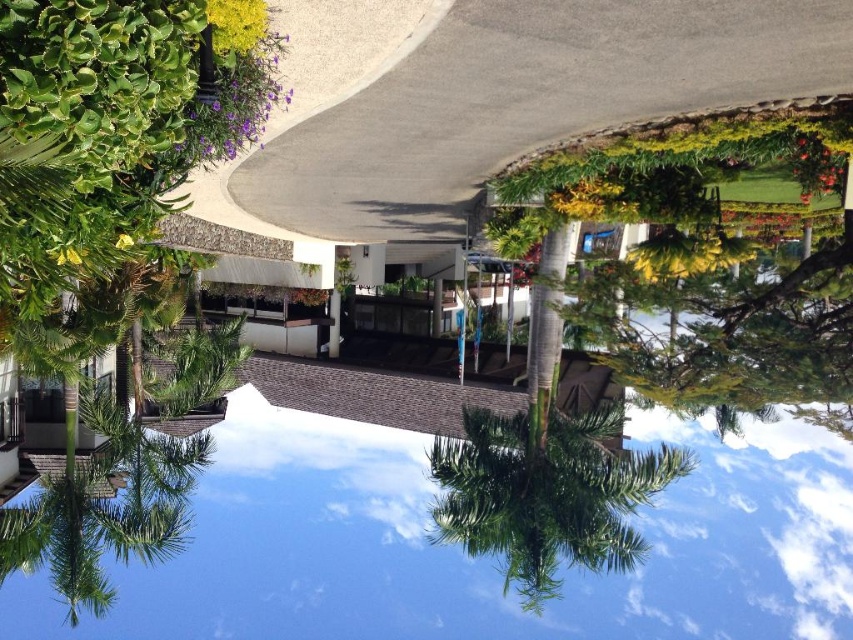
You are standing at the point marked as point (469, 560) in the image. What object is located exactly at your current position?

The transparent glass pool at center is located exactly at point (469, 560).

In the scene shown: You are standing at the entrance of the resort and want to find the transparent glass pool at center. According to the image, where should you look relative to the pathway?

The transparent glass pool at center is located at point coordinates, so you should look towards the center area of the image where the pathway curves, specifically at the coordinates provided.